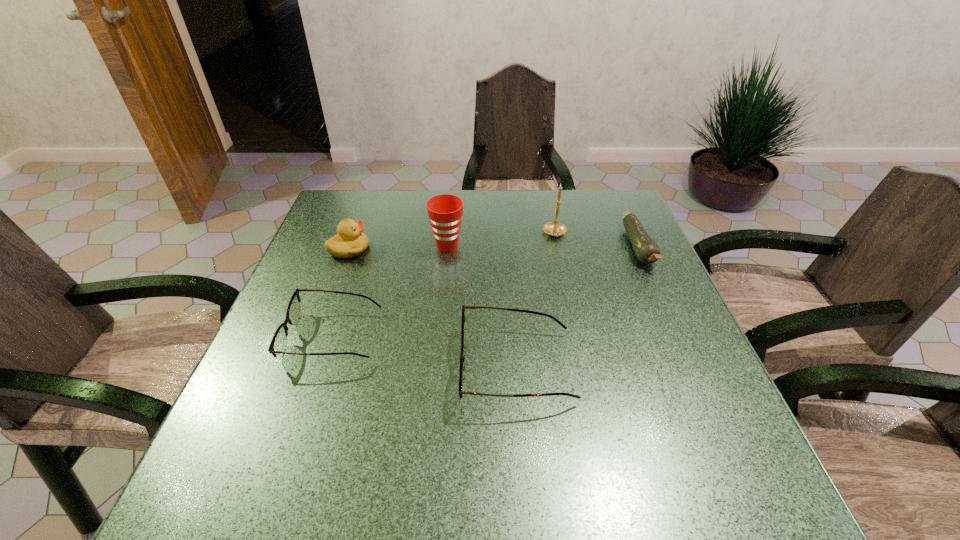
Locate an element on the screen. vacant point located between the fourth tallest object and the rightmost object is located at coordinates (578, 307).

This screenshot has width=960, height=540. In order to click on vacant area that lies between the left spectacles and the fourth object from right to left in this screenshot , I will do `click(391, 291)`.

Identify the location of free area in between the shorter spectacles and the fifth shortest object. (391, 291).

Where is `empty space between the rightmost object and the right spectacles`? The height and width of the screenshot is (540, 960). empty space between the rightmost object and the right spectacles is located at coordinates (578, 307).

At what (x,y) coordinates should I click in order to perform the action: click on empty space that is in between the duckling and the fifth shortest object. Please return your answer as a coordinate pair (x, y). Looking at the image, I should click on (398, 248).

This screenshot has height=540, width=960. Identify the location of empty location between the left spectacles and the candle holder. (444, 285).

I want to click on free spot between the right spectacles and the left spectacles, so click(x=425, y=352).

Find the location of a particular element. This screenshot has height=540, width=960. vacant space that is in between the rightmost object and the cup is located at coordinates (542, 247).

In order to click on free area in between the duckling and the fifth shortest object in this screenshot , I will do `click(398, 248)`.

Image resolution: width=960 pixels, height=540 pixels. What are the coordinates of `free spot between the candle holder and the shorter spectacles` in the screenshot? It's located at (444, 285).